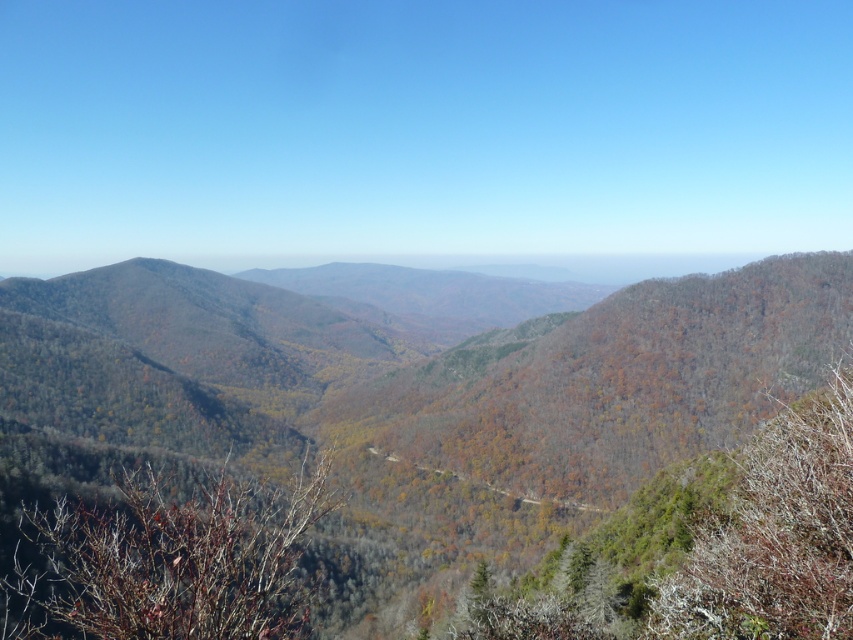
You are a hiker planning to take a photo of the brown textured tree at center and the brown textured tree at right. From your current position, which tree would appear closer to the camera in the photo?

The brown textured tree at center appears closer to the camera because it is positioned under the brown textured tree at right, meaning it is in front of the latter in the scene.

From the picture: You are an environmental scientist studying the spatial arrangement of trees in this mountainous landscape. You observe the brown textured tree at center and the brown textured tree at right. Which tree is located more to the east if the image is oriented with north at the top?

The brown textured tree at center is positioned on the left side of brown textured tree at right. Since the image is oriented with north at the top, the right side of the image corresponds to east. Therefore, the brown textured tree at right is located more to the east than the brown textured tree at center.